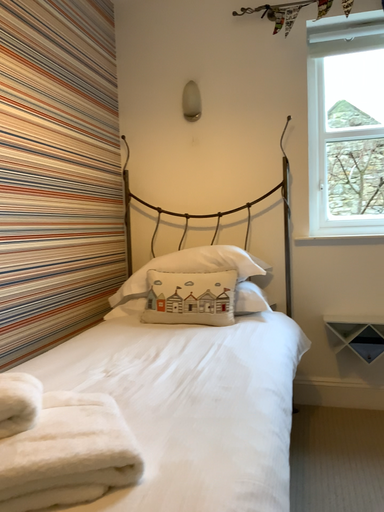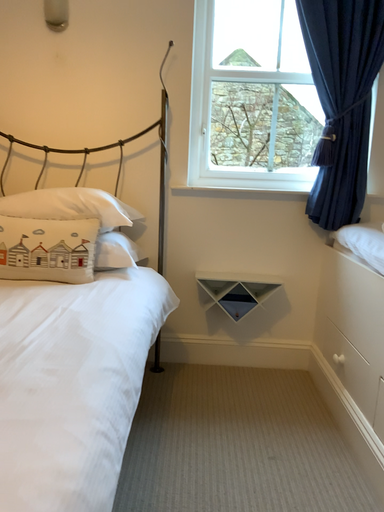
Question: How did the camera likely rotate when shooting the video?

Choices:
 (A) rotated right
 (B) rotated left

Answer: (A)